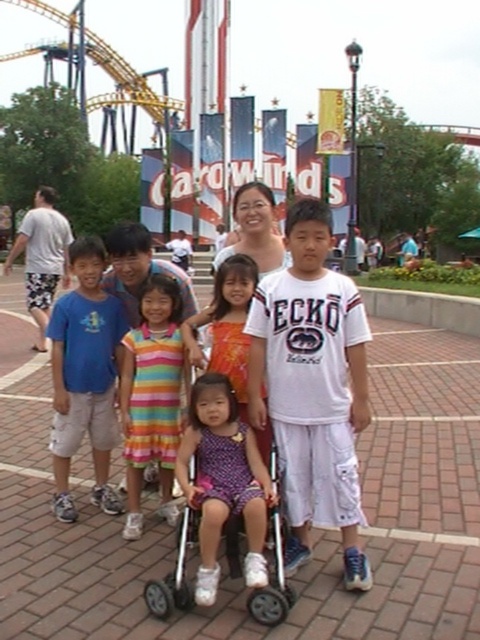
From the picture: Is blue cotton t-shirt at left thinner than plastic baby carriage at center?

In fact, blue cotton t-shirt at left might be wider than plastic baby carriage at center.

Which is behind, point (82, 385) or point (252, 612)?

The point (82, 385) is more distant.

The image size is (480, 640). What do you see at coordinates (84, 376) in the screenshot?
I see `blue cotton t-shirt at left` at bounding box center [84, 376].

This screenshot has height=640, width=480. In order to click on blue cotton t-shirt at left in this screenshot , I will do `click(84, 376)`.

Can you confirm if striped cotton dress at center is positioned to the right of plastic baby carriage at center?

No, striped cotton dress at center is not to the right of plastic baby carriage at center.

Does striped cotton dress at center have a smaller size compared to plastic baby carriage at center?

No.

Describe the element at coordinates (153, 396) in the screenshot. I see `striped cotton dress at center` at that location.

Image resolution: width=480 pixels, height=640 pixels. I want to click on striped cotton dress at center, so click(x=153, y=396).

From the picture: Which of these two, white cotton t-shirt at center or purple satin dress at center, stands taller?

Standing taller between the two is white cotton t-shirt at center.

Does white cotton t-shirt at center have a greater height compared to purple satin dress at center?

Indeed, white cotton t-shirt at center has a greater height compared to purple satin dress at center.

Where is `white cotton t-shirt at center`? This screenshot has height=640, width=480. white cotton t-shirt at center is located at coordinates (312, 387).